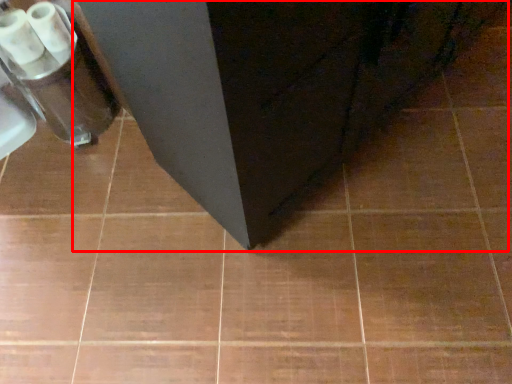
Question: In this image, where is furniture (annotated by the red box) located relative to toilet paper?

Choices:
 (A) right
 (B) left

Answer: (A)